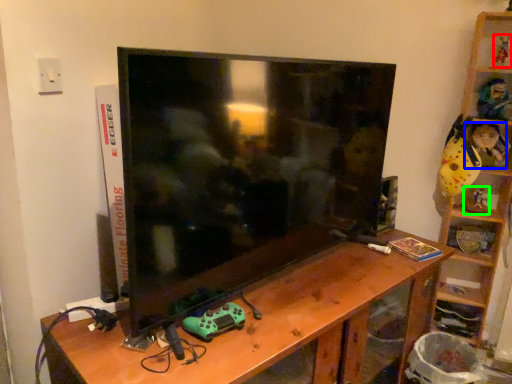
Question: Based on their relative distances, which object is nearer to toy (highlighted by a red box)? Choose from toy (highlighted by a blue box) and toy (highlighted by a green box).

Choices:
 (A) toy
 (B) toy

Answer: (A)